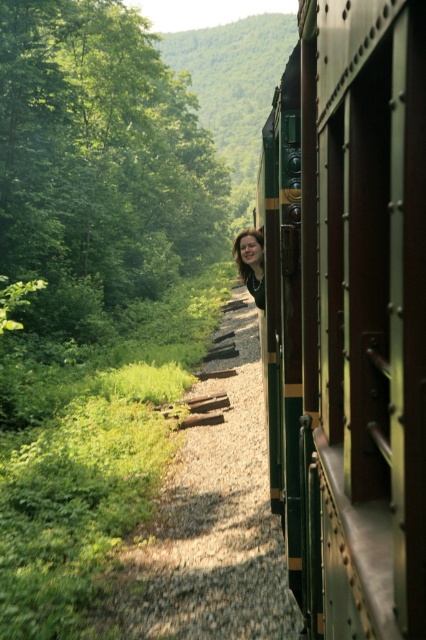
What do you see at coordinates (348, 316) in the screenshot? This screenshot has height=640, width=426. I see `green polished wood train at right` at bounding box center [348, 316].

Which is behind, point (293, 451) or point (5, 1)?

The point (5, 1) is more distant.

Where is `green polished wood train at right`? The height and width of the screenshot is (640, 426). green polished wood train at right is located at coordinates (348, 316).

You are a GUI agent. You are given a task and a screenshot of the screen. Output one action in this format:
    pyautogui.click(x=<x>, y=<y>)
    Task: Click on the green polished wood train at right
    The height and width of the screenshot is (640, 426).
    Given the screenshot: What is the action you would take?
    pyautogui.click(x=348, y=316)

Is green leafy tree at upper left smaller than blonde hair at center?

Incorrect, green leafy tree at upper left is not smaller in size than blonde hair at center.

Where is `green leafy tree at upper left`? Image resolution: width=426 pixels, height=640 pixels. green leafy tree at upper left is located at coordinates (98, 164).

Is point (290, 108) more distant than point (250, 273)?

That is False.

This screenshot has width=426, height=640. What do you see at coordinates (348, 316) in the screenshot? I see `green polished wood train at right` at bounding box center [348, 316].

What are the coordinates of `green polished wood train at right` in the screenshot? It's located at (348, 316).